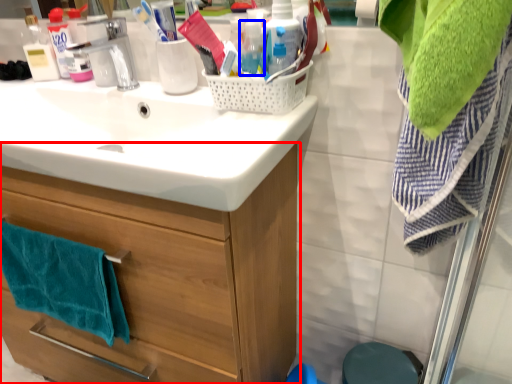
Question: Which object appears farthest to the camera in this image, bathroom cabinet (highlighted by a red box) or bottle (highlighted by a blue box)?

Choices:
 (A) bathroom cabinet
 (B) bottle

Answer: (B)